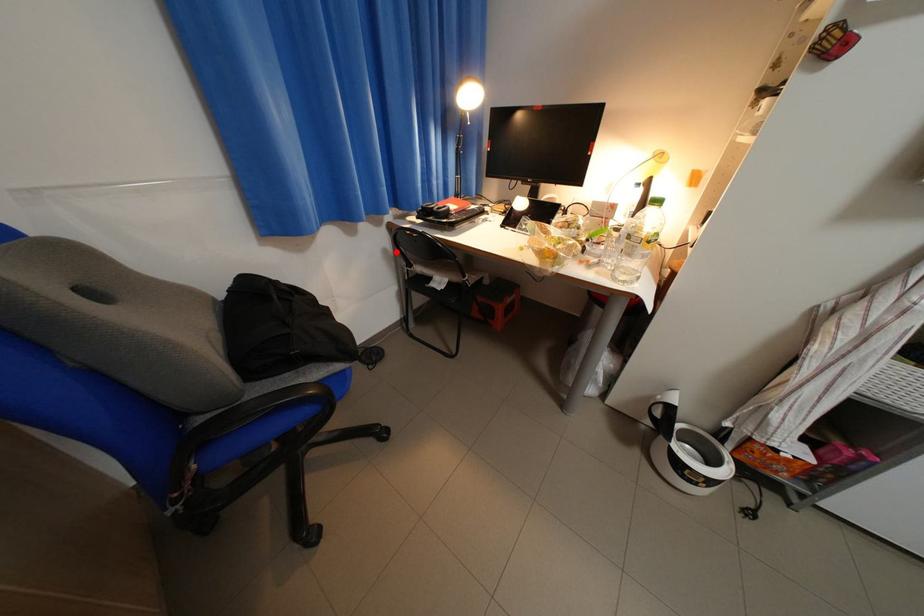
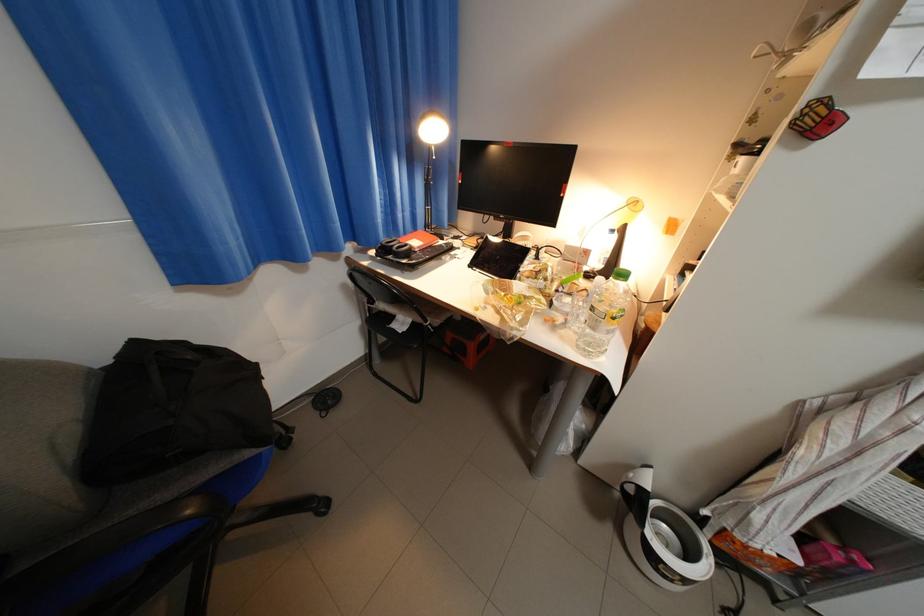
Question: I am providing you with two images of the same scene from different viewpoints. Given a red point in image1, look at the same physical point in image2. Is it:

Choices:
 (A) Closer to the viewpoint
 (B) Farther from the viewpoint

Answer: (B)